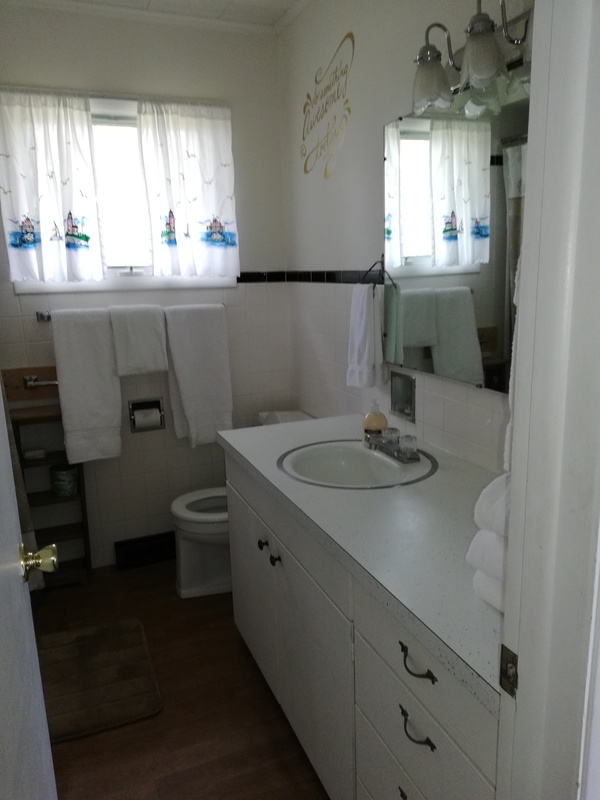
The width and height of the screenshot is (600, 800). Identify the location of sink. (349, 465).